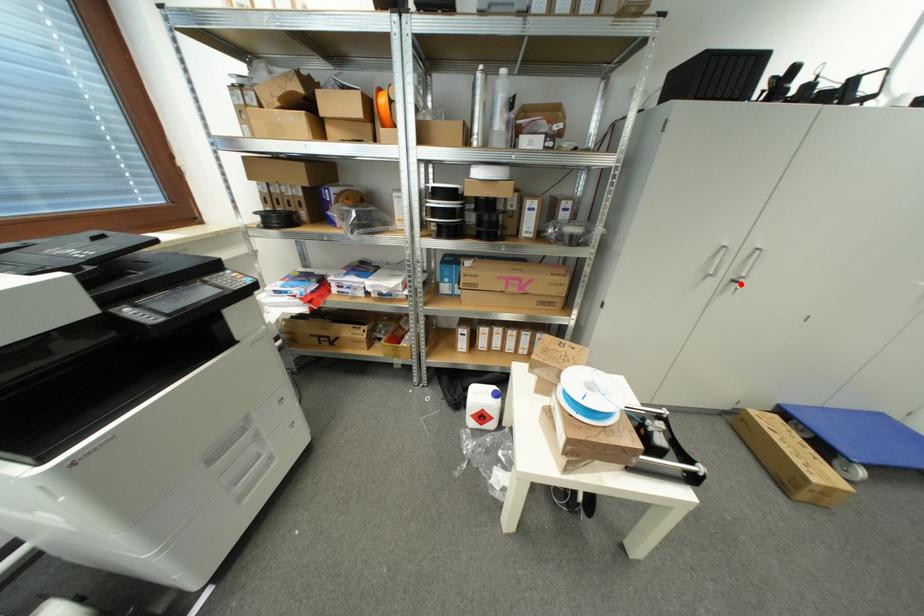
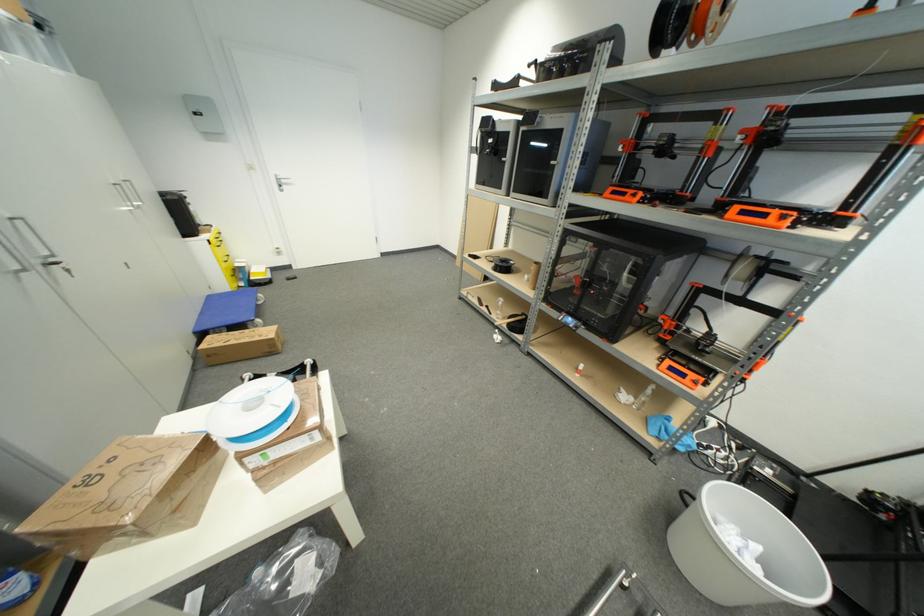
Where in the second image is the point corresponding to the highlighted location from the first image?

(59, 265)